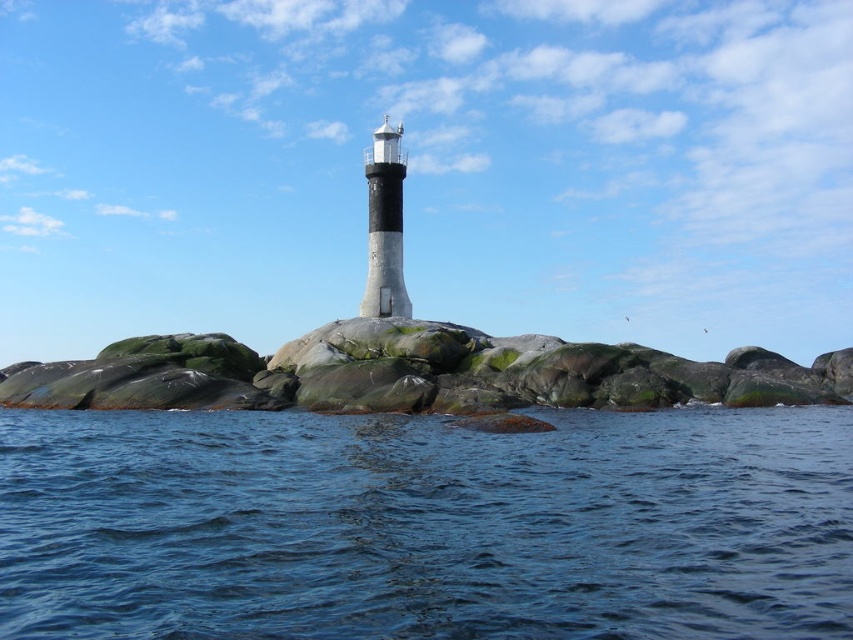
Is point (131, 428) more distant than point (537, 349)?

No, it is in front of (537, 349).

Is blue water at center positioned before green mossy rock at center?

Yes, it is.

Identify the location of blue water at center. This screenshot has width=853, height=640. (426, 525).